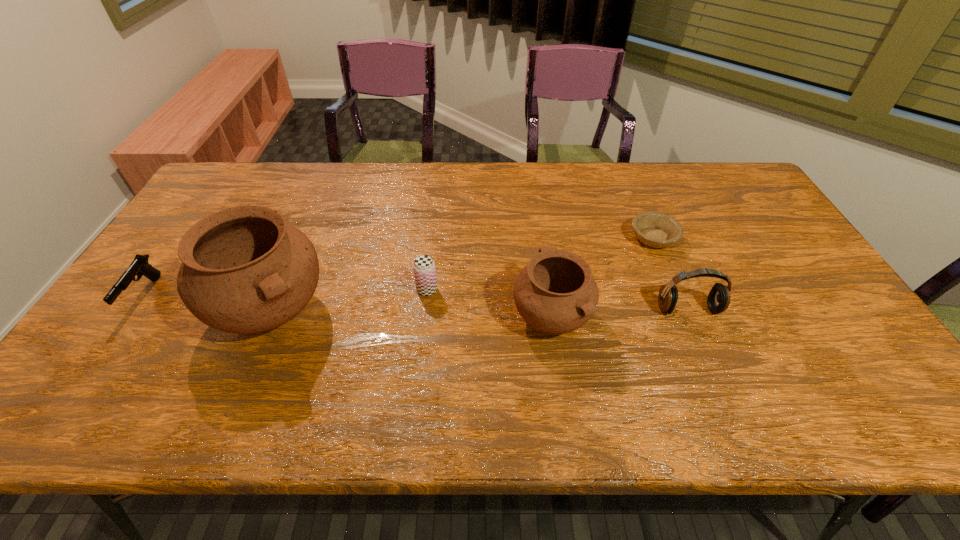
Please point a spot on the right to add another pottery. Please provide its 2D coordinates. Your answer should be formatted as a tuple, i.e. [(x, y)], where the tuple contains the x and y coordinates of a point satisfying the conditions above.

[(838, 324)]